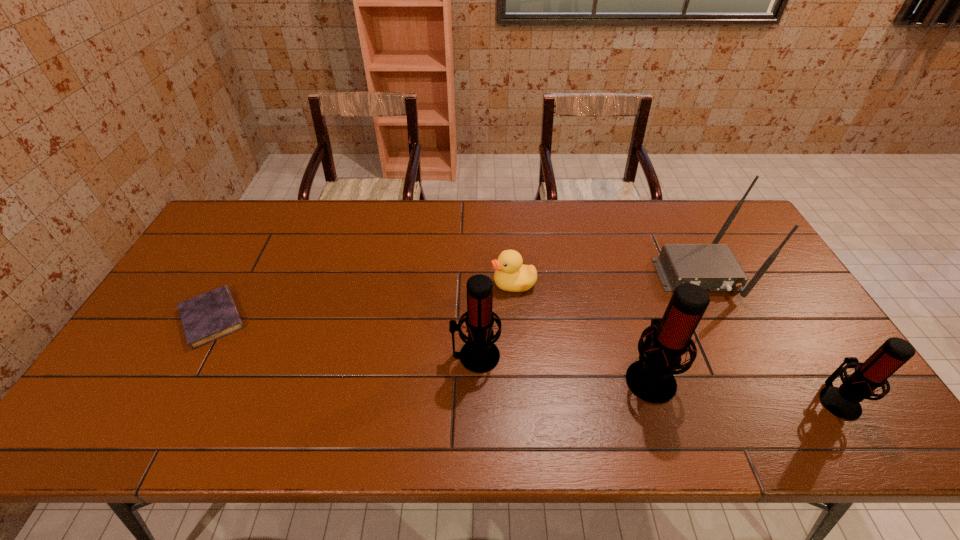
The image size is (960, 540). Identify the location of vacant space situated 0.050m on the back of the fourth tallest object. 815,363.

Image resolution: width=960 pixels, height=540 pixels. Identify the location of vacant area situated on the back of the fifth object from left to right to connect cables. (725, 328).

The image size is (960, 540). I want to click on free space located at the beak of the second shortest object, so click(x=373, y=284).

Find the location of a particular element. The image size is (960, 540). free location located 0.280m at the beak of the second shortest object is located at coordinates (396, 284).

Identify the location of vacant area situated at the beak of the second shortest object. This screenshot has width=960, height=540. (396, 284).

Where is `vacant space located 0.170m on the back of the diary`? Image resolution: width=960 pixels, height=540 pixels. vacant space located 0.170m on the back of the diary is located at coordinates (250, 252).

You are a GUI agent. You are given a task and a screenshot of the screen. Output one action in this format:
    pyautogui.click(x=<x>, y=<y>)
    Task: Click on the object at the left edge
    Image resolution: width=960 pixels, height=540 pixels.
    Given the screenshot: What is the action you would take?
    pyautogui.click(x=212, y=315)

Locate an element on the screen. Image resolution: width=960 pixels, height=540 pixels. microphone that is at the right edge is located at coordinates (843, 402).

The height and width of the screenshot is (540, 960). What are the coordinates of `router that is at the right edge` in the screenshot? It's located at (713, 266).

This screenshot has height=540, width=960. I want to click on object located in the near right corner section of the desktop, so click(843, 402).